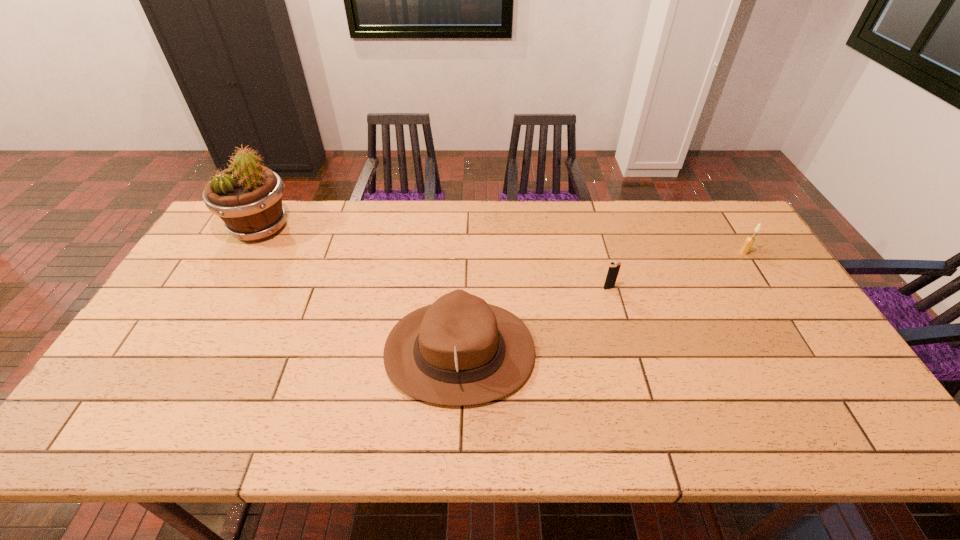
Where is `flowerpot`? The height and width of the screenshot is (540, 960). flowerpot is located at coordinates (247, 196).

Find the location of a particular element. the tallest object is located at coordinates (247, 196).

Find the location of `the nearest object`. the nearest object is located at coordinates (459, 350).

In order to click on fedora in this screenshot , I will do pos(459,350).

Identify the location of the rightmost object. (749, 241).

You are a GUI agent. You are given a task and a screenshot of the screen. Output one action in this format:
    pyautogui.click(x=<x>, y=<y>)
    Task: Click on the third farthest object
    This screenshot has height=540, width=960.
    Given the screenshot: What is the action you would take?
    pyautogui.click(x=614, y=267)

The height and width of the screenshot is (540, 960). Identify the location of the third object from left to right. (614, 267).

Locate an element on the screen. The width and height of the screenshot is (960, 540). free space located on the right of the tallest object is located at coordinates (322, 228).

Where is `free location located on the feather side of the nearest object`? free location located on the feather side of the nearest object is located at coordinates (658, 352).

Where is `vacant space positioned 0.320m on the front of the rightmost object`? The height and width of the screenshot is (540, 960). vacant space positioned 0.320m on the front of the rightmost object is located at coordinates (796, 335).